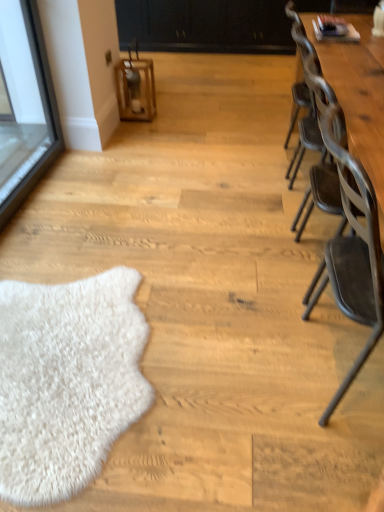
Describe the element at coordinates (358, 94) in the screenshot. The width and height of the screenshot is (384, 512). I see `wooden table at right` at that location.

Image resolution: width=384 pixels, height=512 pixels. I want to click on wooden lantern at center, so click(135, 89).

At what (x,y) coordinates should I click in order to perform the action: click on metallic gray chair at right. Please return your answer as a coordinate pair (x, y). The height and width of the screenshot is (512, 384). Looking at the image, I should click on point(352,250).

The width and height of the screenshot is (384, 512). Identify the location of dresser that is behind the wooden table at right. (206, 26).

How many degrees apart are the facing directions of black matte dresser at upper center and wooden table at right?

They differ by 87.7 degrees in their facing directions.

Considering the relative sizes of black matte dresser at upper center and wooden table at right in the image provided, is black matte dresser at upper center bigger than wooden table at right?

Indeed, black matte dresser at upper center has a larger size compared to wooden table at right.

Is black matte dresser at upper center positioned with its back to wooden table at right?

No, black matte dresser at upper center's orientation is not away from wooden table at right.

Locate an element on the screen. The image size is (384, 512). dresser that appears below the metallic gray chair at right (from a real-world perspective) is located at coordinates click(206, 26).

Looking at this image, is black matte dresser at upper center bigger or smaller than metallic gray chair at right?

black matte dresser at upper center is bigger than metallic gray chair at right.

Does point (252, 53) come farther from viewer compared to point (348, 255)?

Yes.

Is black matte dresser at upper center closer to camera compared to metallic gray chair at right?

No, black matte dresser at upper center is further to the viewer.

Does black matte dresser at upper center have a smaller size compared to wooden lantern at center?

No.

Image resolution: width=384 pixels, height=512 pixels. In order to click on bar stool below the black matte dresser at upper center (from the image's perspective) in this screenshot , I will do [x=135, y=89].

Does point (160, 12) appear closer or farther from the camera than point (133, 97)?

Point (160, 12) appears to be farther away from the viewer than point (133, 97).

In terms of width, does wooden lantern at center look wider or thinner when compared to black matte dresser at upper center?

Clearly, wooden lantern at center has less width compared to black matte dresser at upper center.

Considering the sizes of objects wooden lantern at center and black matte dresser at upper center in the image provided, who is shorter, wooden lantern at center or black matte dresser at upper center?

wooden lantern at center.

Locate an element on the screen. This screenshot has height=512, width=384. dresser above the wooden lantern at center (from the image's perspective) is located at coordinates (206, 26).

From the image's perspective, is wooden lantern at center over black matte dresser at upper center?

No, from the image's perspective, wooden lantern at center is not on top of black matte dresser at upper center.

Relative to wooden lantern at center, is wooden table at right in front or behind?

wooden table at right is in front of wooden lantern at center.

Where is `table above the wooden lantern at center (from a real-world perspective)`? This screenshot has width=384, height=512. table above the wooden lantern at center (from a real-world perspective) is located at coordinates point(358,94).

Is point (378, 118) positioned in front of point (128, 69)?

Yes, point (378, 118) is closer to viewer.

Can you see wooden table at right touching wooden lantern at center?

No, wooden table at right is not touching wooden lantern at center.

Is wooden table at right taller than black matte dresser at upper center?

Correct, wooden table at right is much taller as black matte dresser at upper center.

Considering the points (342, 103) and (180, 23), which point is behind, point (342, 103) or point (180, 23)?

Positioned behind is point (180, 23).

From the image's perspective, which object appears higher, wooden table at right or black matte dresser at upper center?

black matte dresser at upper center appears higher in the image.

Between wooden table at right and black matte dresser at upper center, which one appears on the left side from the viewer's perspective?

black matte dresser at upper center.

Is wooden table at right positioned far away from metallic gray chair at right?

No, wooden table at right is in close proximity to metallic gray chair at right.

From the image's perspective, who appears lower, wooden table at right or metallic gray chair at right?

metallic gray chair at right, from the image's perspective.

Is the position of wooden table at right more distant than that of metallic gray chair at right?

Yes, wooden table at right is behind metallic gray chair at right.

Could you tell me if wooden table at right is turned towards metallic gray chair at right?

No, wooden table at right is not oriented towards metallic gray chair at right.

The height and width of the screenshot is (512, 384). I want to click on dresser located behind the wooden table at right, so click(x=206, y=26).

What are the coordinates of `chair on the right of black matte dresser at upper center` in the screenshot? It's located at (352, 250).

Which object lies further to the anchor point wooden table at right, metallic gray chair at right or black matte dresser at upper center?

black matte dresser at upper center.

Based on their spatial positions, is metallic gray chair at right or wooden lantern at center further from black matte dresser at upper center?

metallic gray chair at right is positioned further to the anchor black matte dresser at upper center.

When comparing their distances from metallic gray chair at right, does wooden lantern at center or black matte dresser at upper center seem closer?

Based on the image, wooden lantern at center appears to be nearer to metallic gray chair at right.

Considering their positions, is wooden table at right positioned closer to wooden lantern at center than black matte dresser at upper center?

wooden table at right.

Estimate the real-world distances between objects in this image. Which object is further from metallic gray chair at right, wooden lantern at center or wooden table at right?

Among the two, wooden lantern at center is located further to metallic gray chair at right.

Estimate the real-world distances between objects in this image. Which object is further from wooden table at right, metallic gray chair at right or wooden lantern at center?

The object further to wooden table at right is wooden lantern at center.

Which object lies nearer to the anchor point metallic gray chair at right, wooden table at right or wooden lantern at center?

wooden table at right is closer to metallic gray chair at right.

Looking at the image, which one is located closer to wooden lantern at center, black matte dresser at upper center or metallic gray chair at right?

black matte dresser at upper center.

Locate an element on the screen. The height and width of the screenshot is (512, 384). table between metallic gray chair at right and wooden lantern at center in the front-back direction is located at coordinates (358, 94).

Image resolution: width=384 pixels, height=512 pixels. I want to click on table between metallic gray chair at right and black matte dresser at upper center in the front-back direction, so click(x=358, y=94).

The width and height of the screenshot is (384, 512). I want to click on bar stool between metallic gray chair at right and black matte dresser at upper center from front to back, so click(135, 89).

The width and height of the screenshot is (384, 512). I want to click on bar stool positioned between wooden table at right and black matte dresser at upper center from near to far, so click(x=135, y=89).